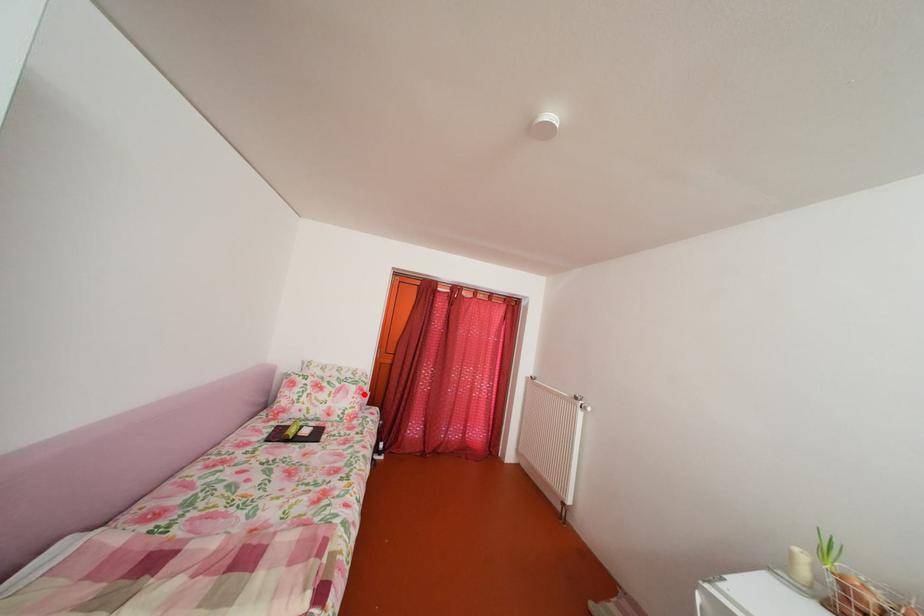
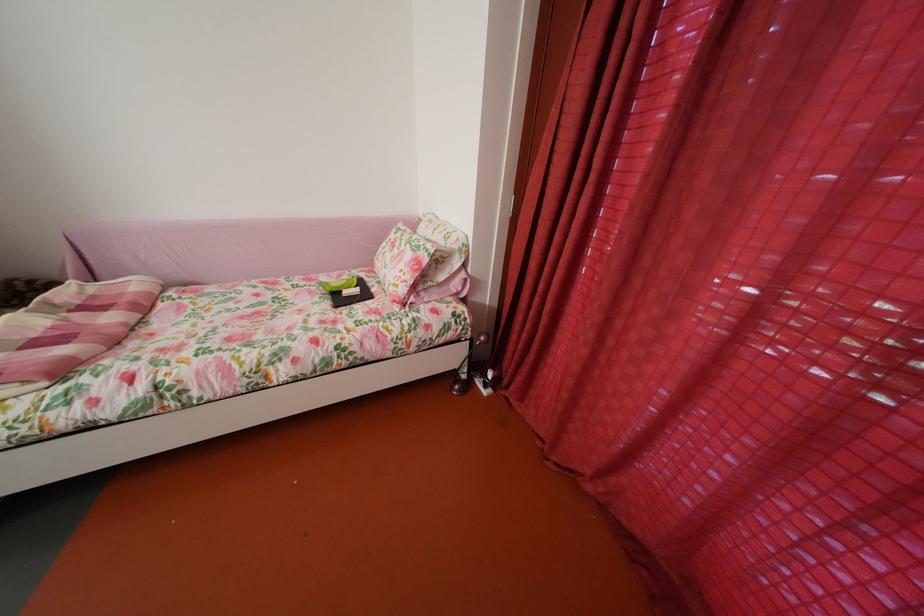
Find the pixel in the second image that matches the highlighted location in the first image.

(419, 262)